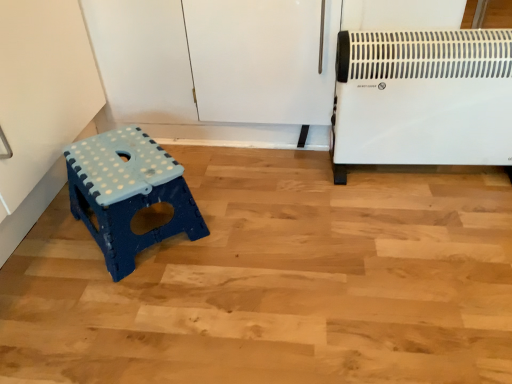
Where is `vacant space that's between white plastic heater at right and blue plastic stool at lower left`? vacant space that's between white plastic heater at right and blue plastic stool at lower left is located at coordinates (298, 207).